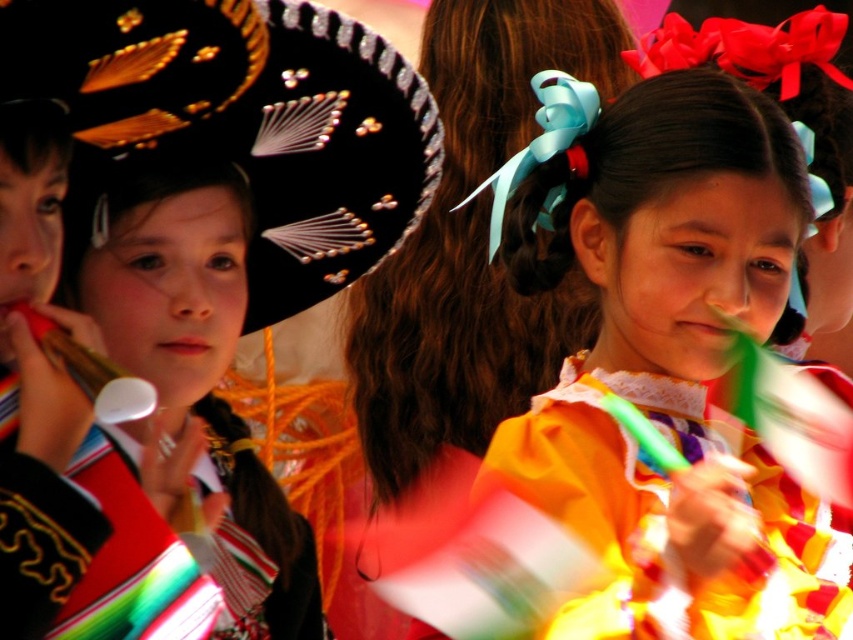
Identify the location of black satin sombrero at left. (242, 120).

Between black satin sombrero at left and multicolored fabric at left, which one has less height?

black satin sombrero at left

Is point (431, 189) less distant than point (222, 560)?

No.

The image size is (853, 640). What are the coordinates of `black satin sombrero at left` in the screenshot? It's located at (242, 120).

From the picture: Can you confirm if yellow satin dress at center is wider than multicolored fabric at left?

Correct, the width of yellow satin dress at center exceeds that of multicolored fabric at left.

Between point (618, 508) and point (109, 628), which one is positioned in front?

Point (109, 628) is more forward.

Which is behind, point (665, 420) or point (312, 557)?

The point (312, 557) is behind.

At what (x,y) coordinates should I click in order to perform the action: click on yellow satin dress at center. Please return your answer as a coordinate pair (x, y). Looking at the image, I should click on (668, 518).

Who is more distant from viewer, [698,113] or [722,612]?

Point [698,113]

From the picture: Who is positioned more to the left, matte yellow dress at center or yellow satin dress at center?

Positioned to the left is matte yellow dress at center.

Is point (839, 627) in front of point (584, 438)?

Yes, point (839, 627) is in front of point (584, 438).

You are a GUI agent. You are given a task and a screenshot of the screen. Output one action in this format:
    pyautogui.click(x=<x>, y=<y>)
    Task: Click on the matte yellow dress at center
    The height and width of the screenshot is (640, 853).
    Given the screenshot: What is the action you would take?
    coord(671,365)